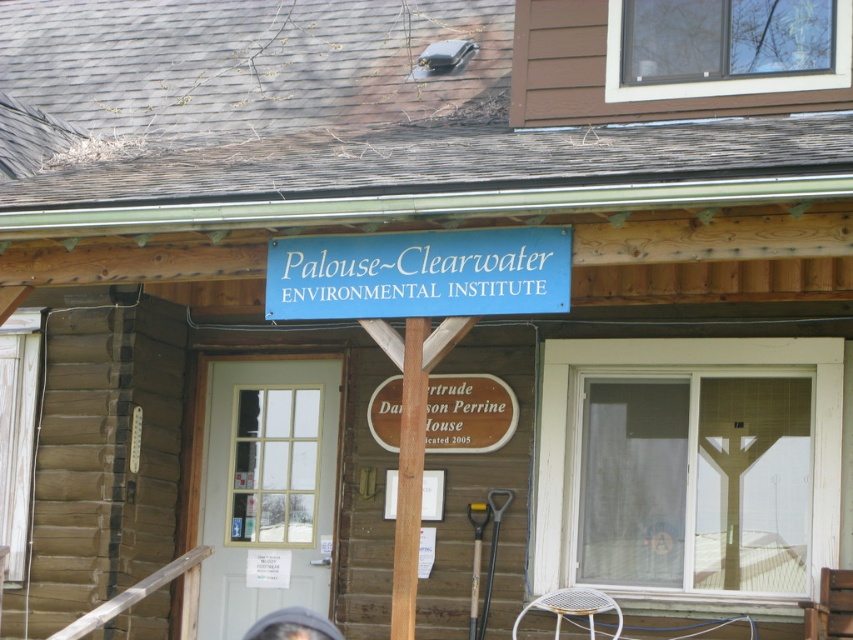
Question: Is the position of blue matte sign at center less distant than that of dark brown hair at center?

Choices:
 (A) yes
 (B) no

Answer: (A)

Question: Which point appears closest to the camera in this image?

Choices:
 (A) (526, 257)
 (B) (306, 609)

Answer: (A)

Question: Which of the following is the closest to the observer?

Choices:
 (A) (279, 627)
 (B) (293, 241)

Answer: (B)

Question: Is the position of blue matte sign at center less distant than that of dark brown hair at center?

Choices:
 (A) no
 (B) yes

Answer: (B)

Question: Is blue matte sign at center above dark brown hair at center?

Choices:
 (A) yes
 (B) no

Answer: (A)